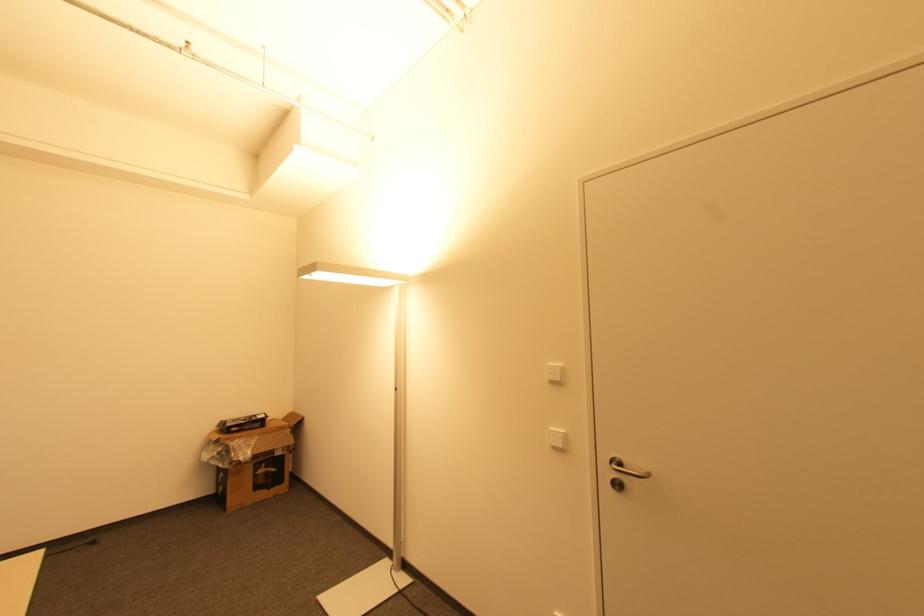
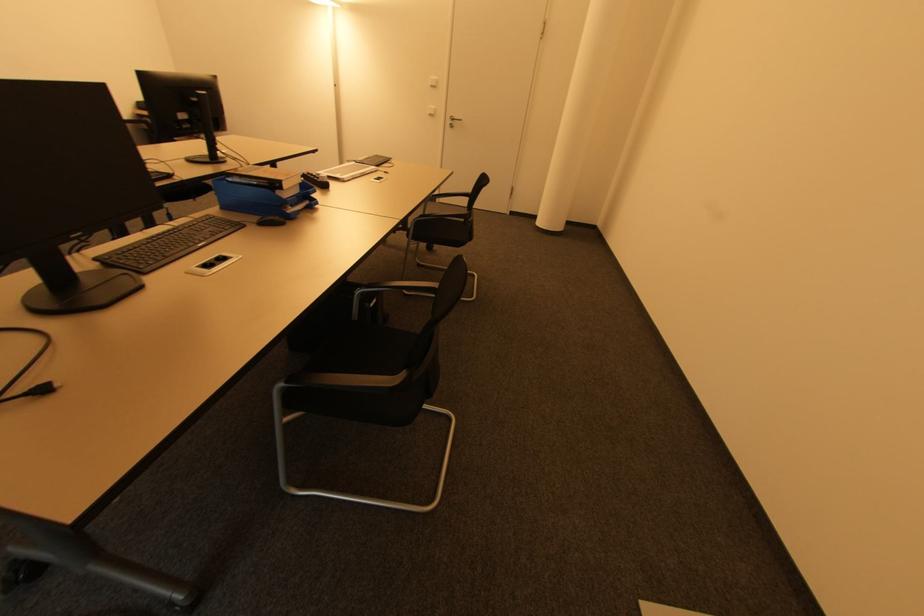
The point at (554, 383) is marked in the first image. Where is the corresponding point in the second image?

(434, 87)